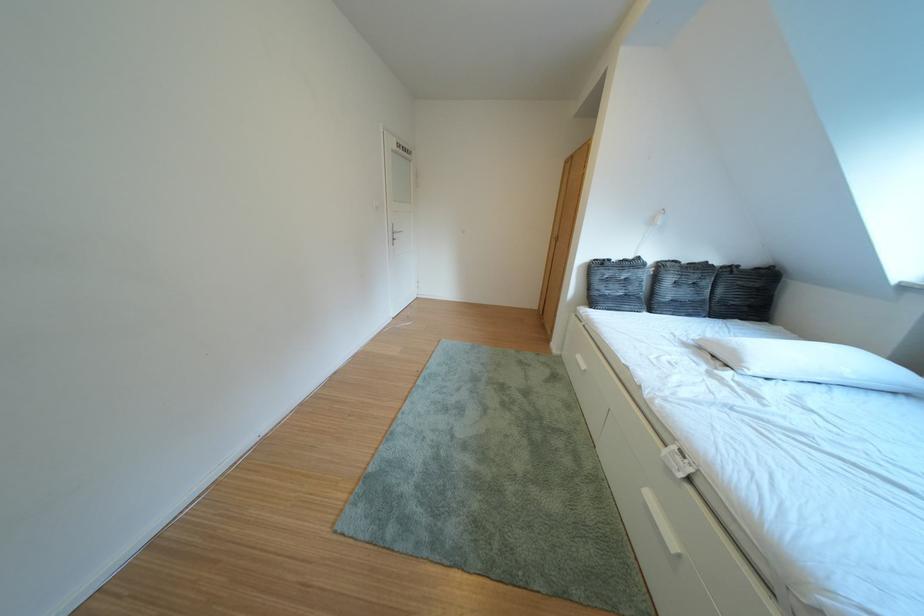
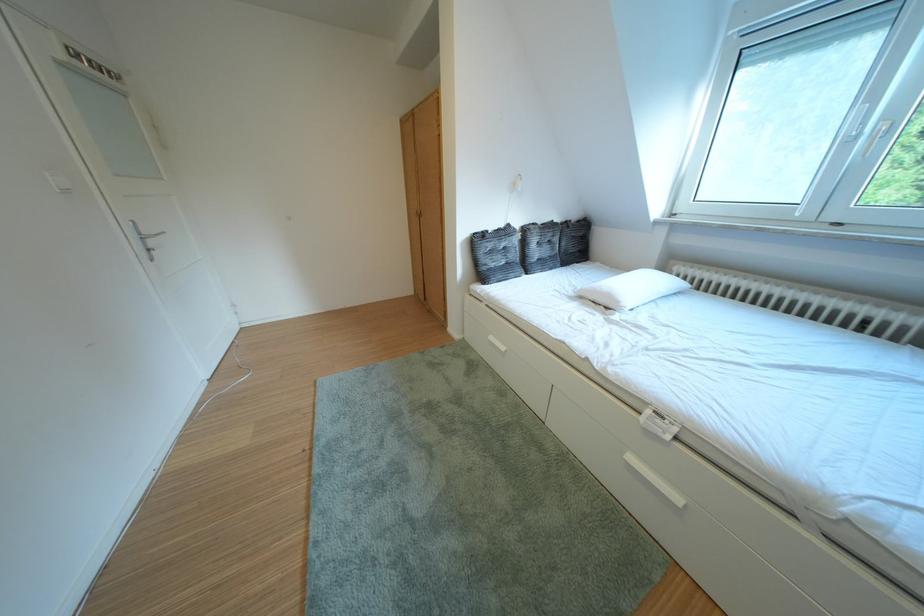
The point at (763, 267) is marked in the first image. Where is the corresponding point in the second image?

(588, 222)